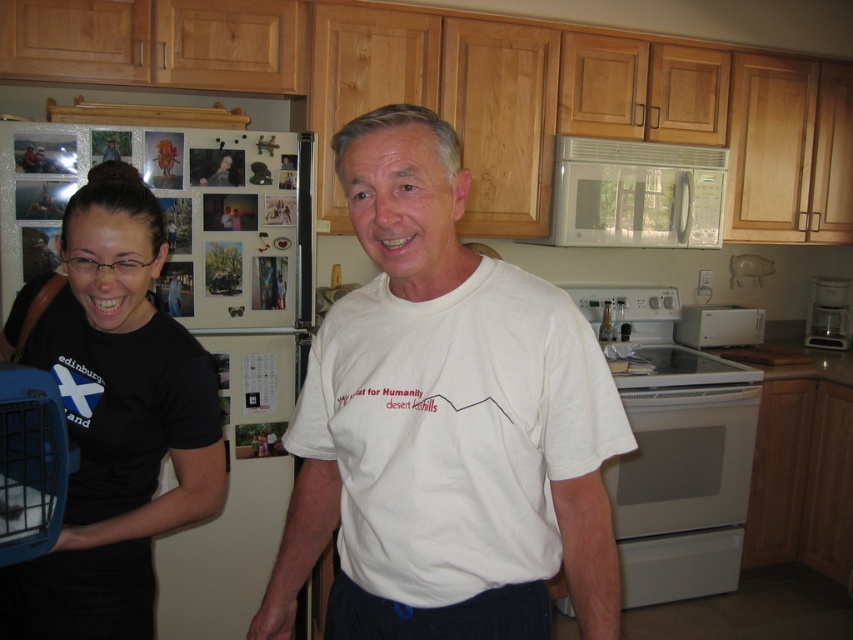
Question: Does white glossy microwave at upper center appear under metallic silver coffee maker at right?

Choices:
 (A) no
 (B) yes

Answer: (A)

Question: Among these points, which one is nearest to the camera?

Choices:
 (A) (38, 588)
 (B) (512, 305)
 (C) (741, 440)
 (D) (845, 339)

Answer: (B)

Question: Does white cotton t-shirt at center come behind white glossy microwave at upper center?

Choices:
 (A) no
 (B) yes

Answer: (A)

Question: Which of the following is the farthest from the observer?

Choices:
 (A) metallic silver coffee maker at right
 (B) white glossy microwave at upper center
 (C) white cotton t-shirt at center

Answer: (A)

Question: Estimate the real-world distances between objects in this image. Which object is farther from the metallic silver coffee maker at right?

Choices:
 (A) white glossy microwave at upper center
 (B) black matte shirt at left

Answer: (B)

Question: Can you confirm if white glossy electric stove at center is positioned to the left of white glossy microwave at upper center?

Choices:
 (A) yes
 (B) no

Answer: (B)